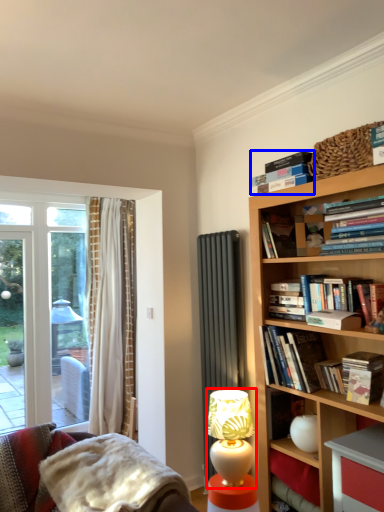
Question: Which of the following is the closest to the observer, table lamp (highlighted by a red box) or book (highlighted by a blue box)?

Choices:
 (A) table lamp
 (B) book

Answer: (B)